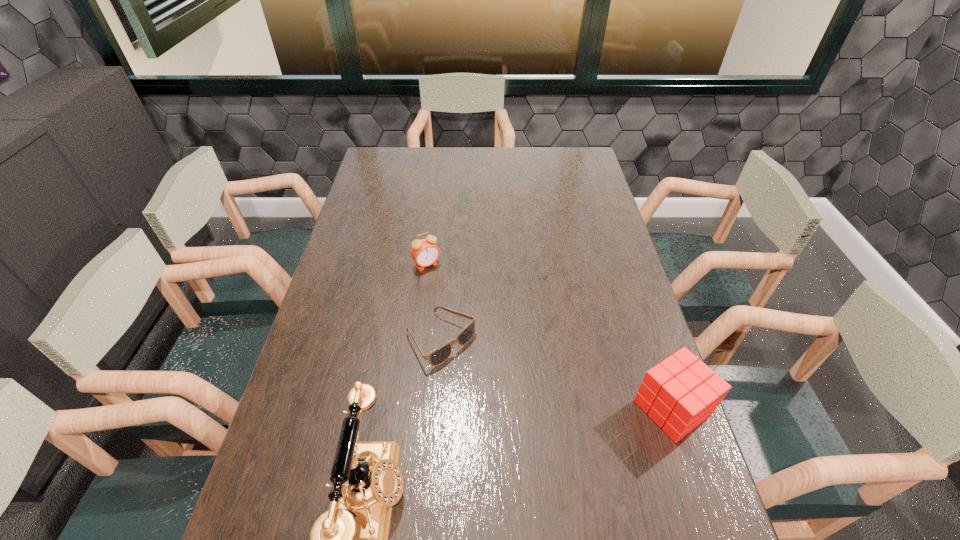
I want to click on vacant space on the desktop that is between the telephone and the rightmost object and is positioned on the face of the farthest object, so click(x=551, y=444).

The height and width of the screenshot is (540, 960). Find the location of `free space on the desktop that is between the tallest object and the cube and is positioned on the frames of the sunglasses`. free space on the desktop that is between the tallest object and the cube and is positioned on the frames of the sunglasses is located at coordinates (561, 442).